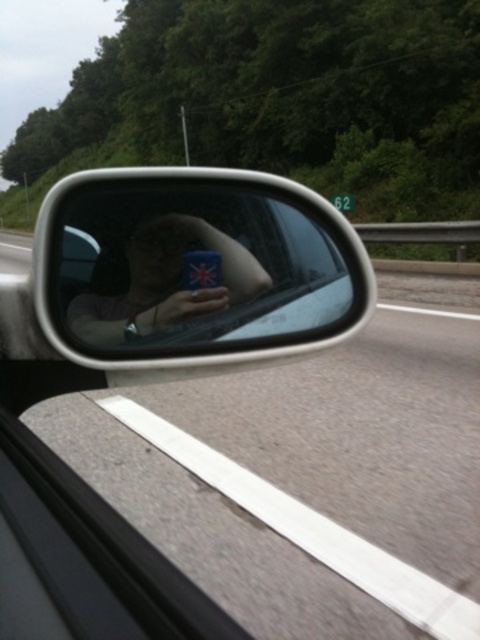
Question: Can you confirm if silver metallic mirror at center is bigger than asphalt road at lower left?

Choices:
 (A) no
 (B) yes

Answer: (A)

Question: Does silver metallic mirror at center lie behind metallic blue phone at center?

Choices:
 (A) yes
 (B) no

Answer: (B)

Question: Considering the real-world distances, which object is closest to the asphalt road at lower left?

Choices:
 (A) metallic blue phone at center
 (B) silver metallic mirror at center

Answer: (B)

Question: Which point is closer to the camera?

Choices:
 (A) asphalt road at lower left
 (B) silver metallic mirror at center
 (C) metallic blue phone at center

Answer: (B)

Question: Can you confirm if metallic blue phone at center is thinner than asphalt road at lower left?

Choices:
 (A) yes
 (B) no

Answer: (A)

Question: Which point appears closest to the camera in this image?

Choices:
 (A) (11, 248)
 (B) (159, 243)
 (C) (63, 304)

Answer: (C)